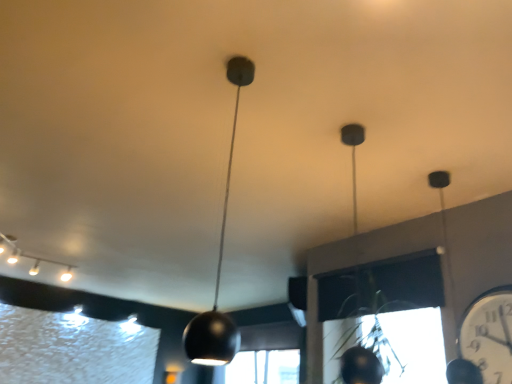
Question: Is white glossy clock at right outside white glossy track lights at upper left, the 2th lamp viewed from the front?

Choices:
 (A) no
 (B) yes

Answer: (B)

Question: Considering the relative sizes of white glossy clock at right and white glossy track lights at upper left, marked as the second lamp in a right-to-left arrangement, in the image provided, is white glossy clock at right shorter than white glossy track lights at upper left, marked as the second lamp in a right-to-left arrangement,?

Choices:
 (A) yes
 (B) no

Answer: (B)

Question: Is white glossy clock at right looking in the opposite direction of white glossy track lights at upper left, marked as the second lamp in a right-to-left arrangement?

Choices:
 (A) yes
 (B) no

Answer: (B)

Question: Is white glossy clock at right further to the viewer compared to white glossy track lights at upper left, which ranks as the 1th lamp in left-to-right order?

Choices:
 (A) yes
 (B) no

Answer: (B)

Question: Considering the relative sizes of white glossy clock at right and white glossy track lights at upper left, the 2th lamp viewed from the front, in the image provided, is white glossy clock at right thinner than white glossy track lights at upper left, the 2th lamp viewed from the front,?

Choices:
 (A) no
 (B) yes

Answer: (B)

Question: Does white glossy clock at right have a larger size compared to white glossy track lights at upper left, the 2th lamp viewed from the front?

Choices:
 (A) no
 (B) yes

Answer: (A)

Question: Is white glossy track lights at upper left, the 2th lamp viewed from the front, smaller than matte black pendant light at center, marked as the second lamp in a back-to-front arrangement?

Choices:
 (A) no
 (B) yes

Answer: (A)

Question: Is white glossy track lights at upper left, positioned as the 1th lamp in back-to-front order, thinner than matte black pendant light at center, the 1th lamp positioned from the front?

Choices:
 (A) yes
 (B) no

Answer: (B)

Question: Is white glossy track lights at upper left, the 2th lamp viewed from the front, facing away from matte black pendant light at center, the second lamp positioned from the left?

Choices:
 (A) yes
 (B) no

Answer: (B)

Question: From the image's perspective, is white glossy track lights at upper left, marked as the second lamp in a right-to-left arrangement, located beneath matte black pendant light at center, the second lamp positioned from the left?

Choices:
 (A) yes
 (B) no

Answer: (A)

Question: From the image's perspective, is white glossy track lights at upper left, the 2th lamp viewed from the front, on matte black pendant light at center, marked as the second lamp in a back-to-front arrangement?

Choices:
 (A) yes
 (B) no

Answer: (B)

Question: Does white glossy track lights at upper left, which ranks as the 1th lamp in left-to-right order, touch matte black pendant light at center, which is the first lamp from right to left?

Choices:
 (A) yes
 (B) no

Answer: (B)

Question: From a real-world perspective, is white glossy clock at right located beneath matte black pendant light at center, the 1th lamp positioned from the front?

Choices:
 (A) no
 (B) yes

Answer: (B)